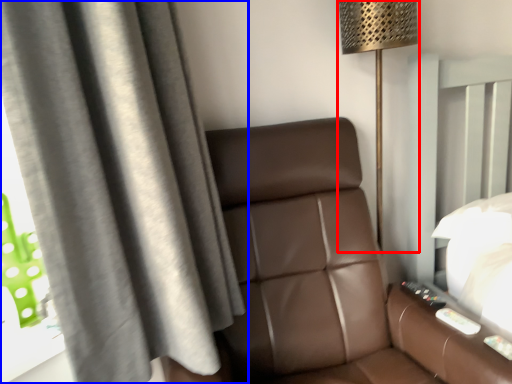
Question: Which point is further to the camera, lamp (highlighted by a red box) or curtain (highlighted by a blue box)?

Choices:
 (A) lamp
 (B) curtain

Answer: (A)